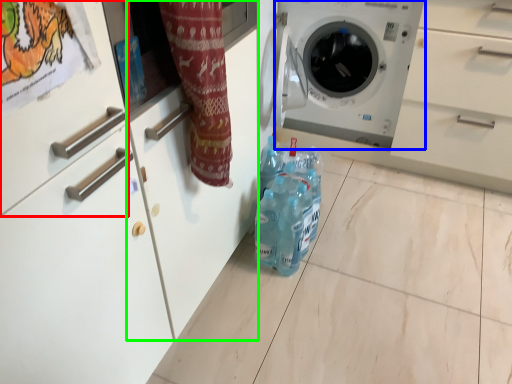
Question: Which object is the closest to the drawer (highlighted by a red box)? Choose among these: washing machine (highlighted by a blue box) or cabinetry (highlighted by a green box).

Choices:
 (A) washing machine
 (B) cabinetry

Answer: (B)